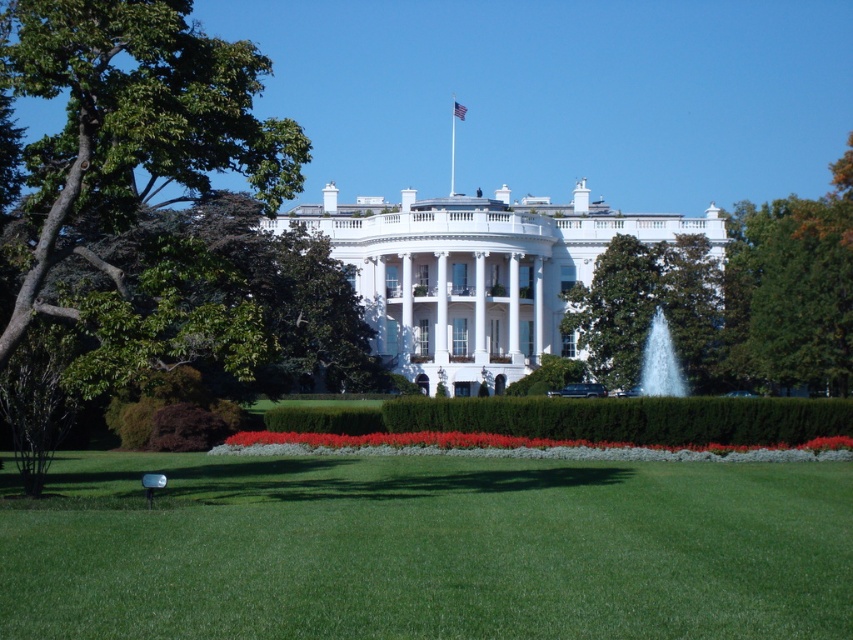
Question: Can you confirm if green leafy tree at center is smaller than clear glass fountain at center?

Choices:
 (A) yes
 (B) no

Answer: (B)

Question: Is clear glass fountain at center further to camera compared to american flag at center?

Choices:
 (A) no
 (B) yes

Answer: (A)

Question: Which of the following is the closest to the observer?

Choices:
 (A) american flag at center
 (B) green leafy tree at right
 (C) clear glass fountain at center
 (D) red velvet flowers at center

Answer: (D)

Question: Can you confirm if red velvet flowers at center is positioned to the right of american flag at center?

Choices:
 (A) yes
 (B) no

Answer: (A)

Question: Which of these objects is positioned closest to the green grass lawn at center?

Choices:
 (A) american flag at center
 (B) red velvet flowers at center
 (C) green leafy tree at center
 (D) clear glass fountain at center

Answer: (B)

Question: Which point is farther to the camera?

Choices:
 (A) clear glass fountain at center
 (B) green leafy tree at right
 (C) green grass lawn at center
 (D) green leafy tree at center

Answer: (D)